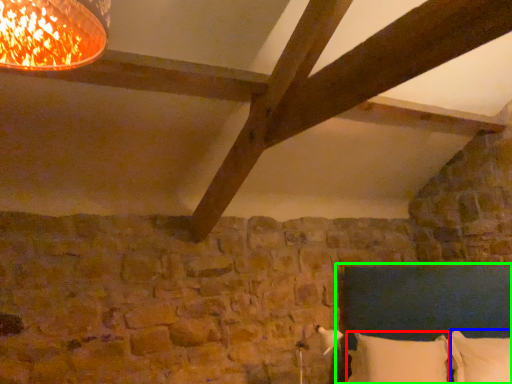
Question: Estimate the real-world distances between objects in this image. Which object is closer to pillow (highlighted by a red box), pillow (highlighted by a blue box) or bed (highlighted by a green box)?

Choices:
 (A) pillow
 (B) bed

Answer: (A)